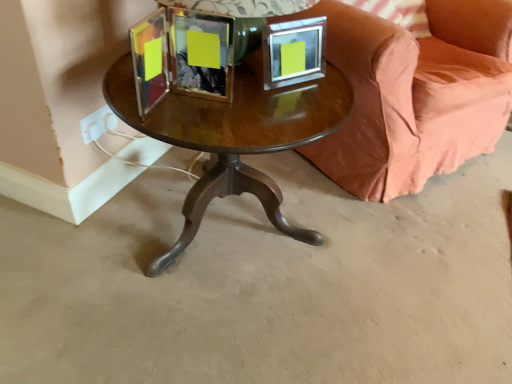
Identify the location of free space above shiny brown wood coffee table at center (from a real-world perspective). The width and height of the screenshot is (512, 384). (241, 98).